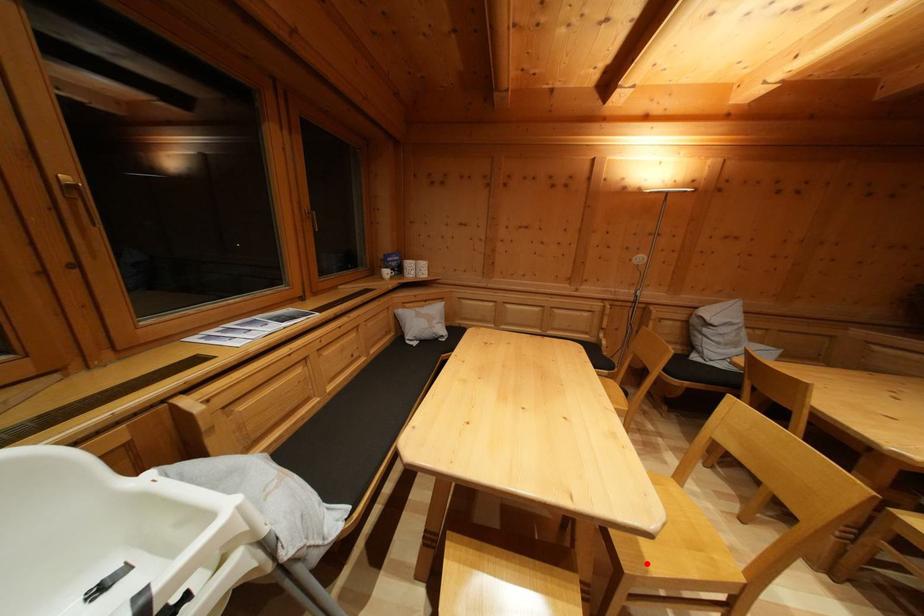
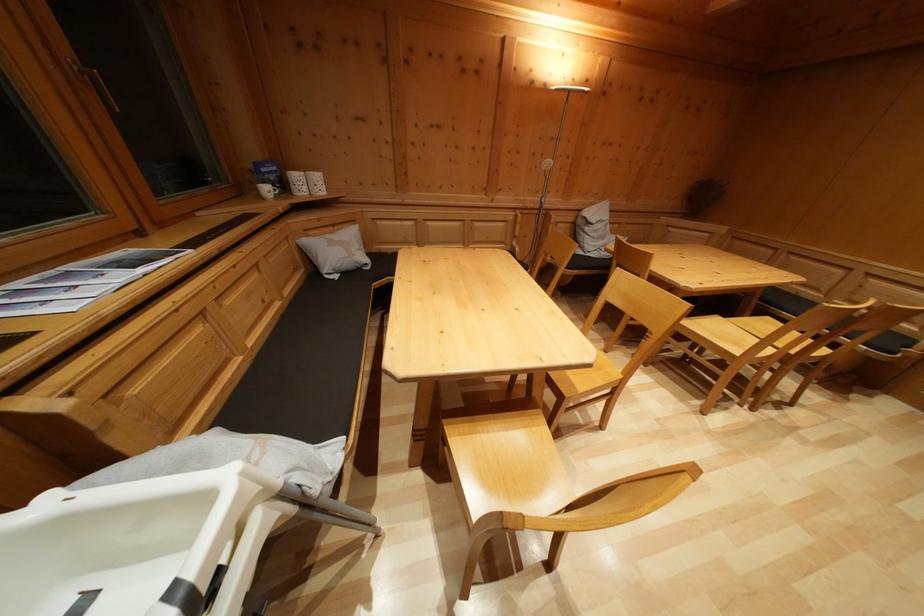
Find the pixel in the second image that matches the highlighted location in the first image.

(578, 392)